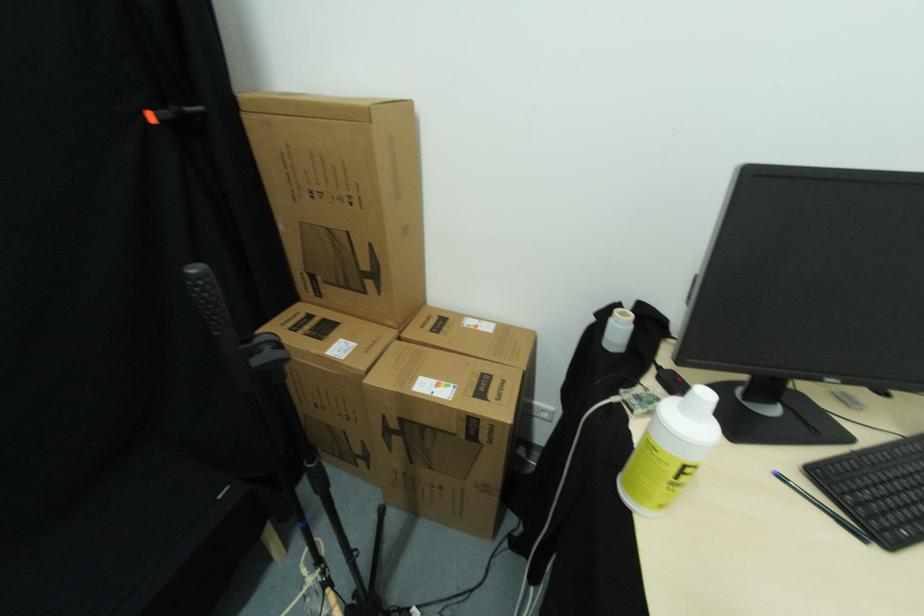
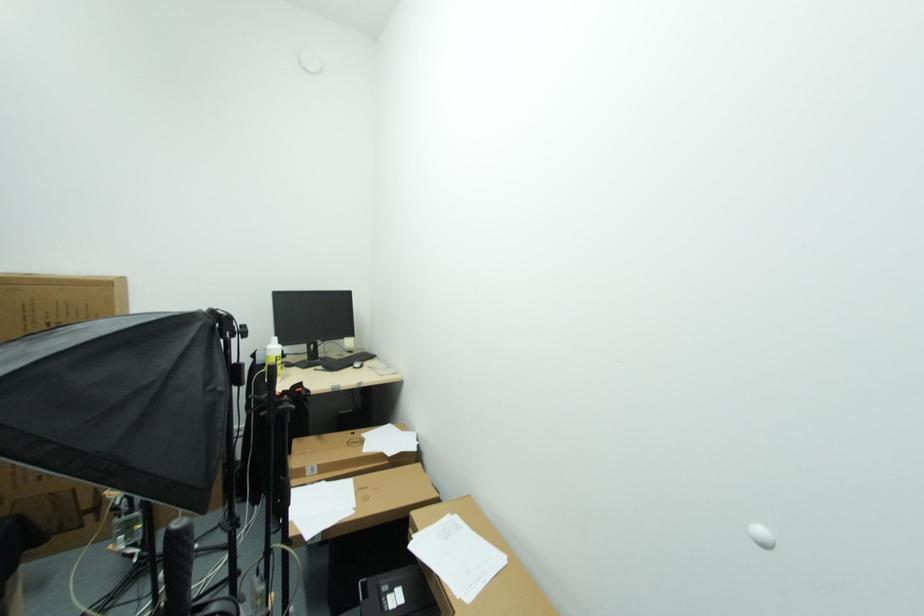
The point at (319, 197) is marked in the first image. Where is the corresponding point in the second image?

(53, 328)